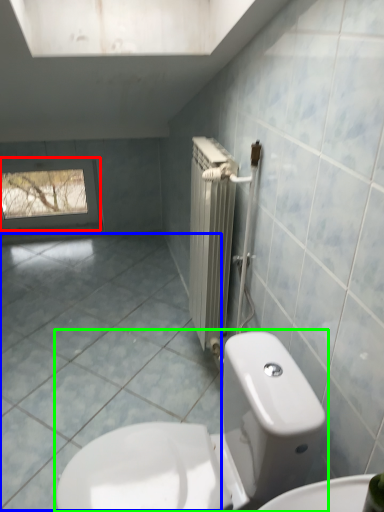
Question: Estimate the real-world distances between objects in this image. Which object is closer to window (highlighted by a red box), ceramic tile (highlighted by a blue box) or toilet (highlighted by a green box)?

Choices:
 (A) ceramic tile
 (B) toilet

Answer: (A)